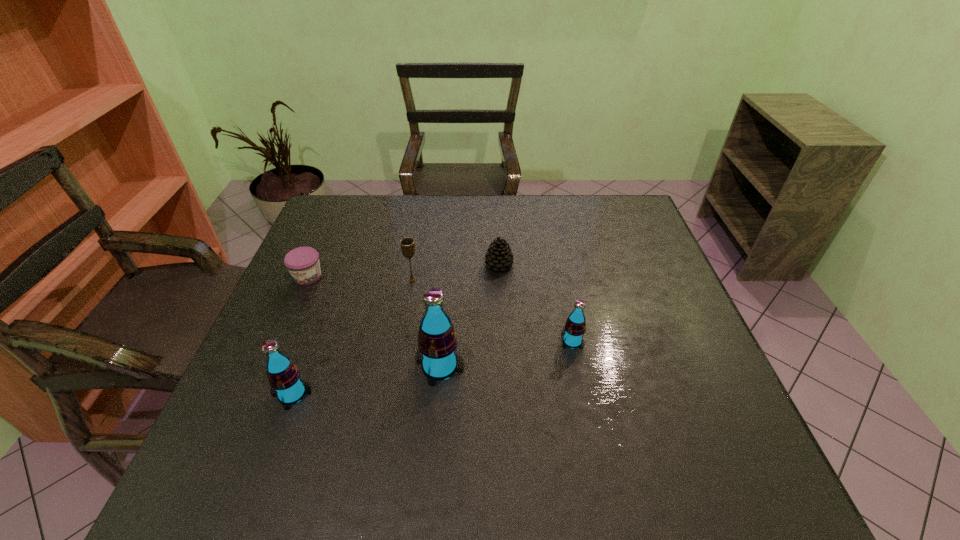
All sodas are currently evenly spaced. To continue this pattern, where would you add another soda on the right? Please point out a vacant spot. Please provide its 2D coordinates. Your answer should be formatted as a tuple, i.e. [(x, y)], where the tuple contains the x and y coordinates of a point satisfying the conditions above.

[(692, 319)]